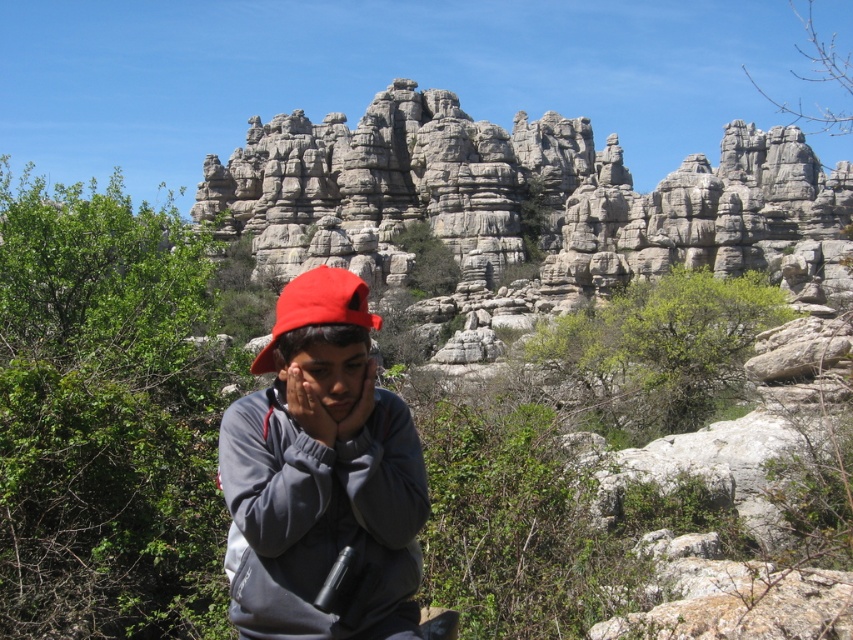
You are standing in the outdoor scene and want to take a photo of the gray rocky cliff at center. If your camera has a focal length of 50mm and you want to capture the entire cliff in the frame, would you need to zoom in or out? Explain your reasoning based on the distance provided.

The gray rocky cliff at center is 57.35 meters away from the viewer. With a 50mm focal length, which is considered a standard lens providing a field of view similar to human vision, you would likely need to zoom out to a wider angle to ensure the entire cliff fits in the frame. This is because the cliff is relatively far away, so a wider angle would capture more of the scene and the distant object.

You are a photographer adjusting your camera settings to capture the scene. You notice two points in the frame at coordinates point (277, 237) and point (332, 268). Which point is closer to the camera?

Point (332, 268) is closer to the camera than point (277, 237).

Where is the matte gray sweatshirt at center located in the image?

The matte gray sweatshirt at center is located at point coordinates of (321, 474).